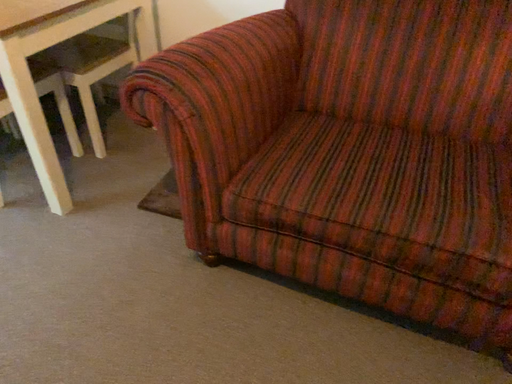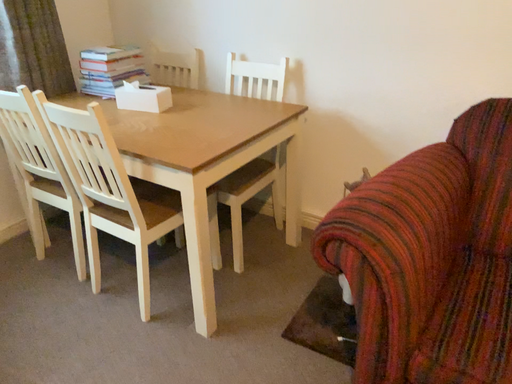
Question: How did the camera likely rotate when shooting the video?

Choices:
 (A) rotated upward
 (B) rotated downward

Answer: (A)